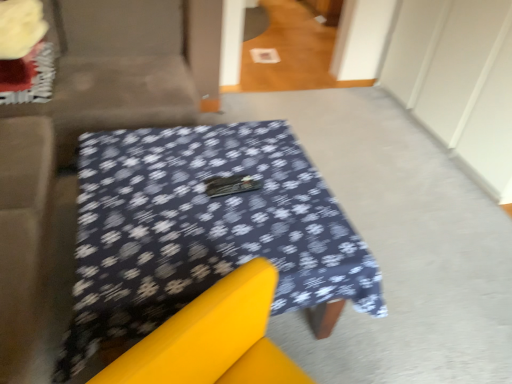
This screenshot has height=384, width=512. Identify the location of free space above dark blue fabric-covered table at center (from a real-world perspective). (199, 201).